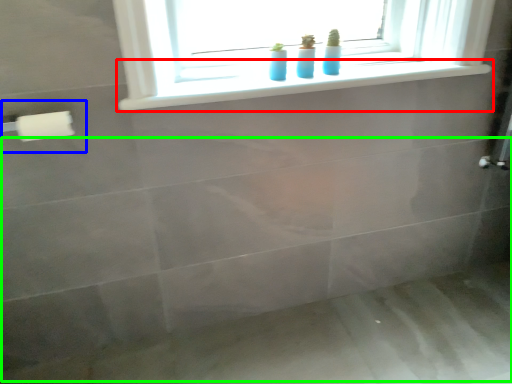
Question: Which object is positioned closest to window sill (highlighted by a red box)? Select from towel bar (highlighted by a blue box) and bath (highlighted by a green box).

Choices:
 (A) towel bar
 (B) bath

Answer: (A)